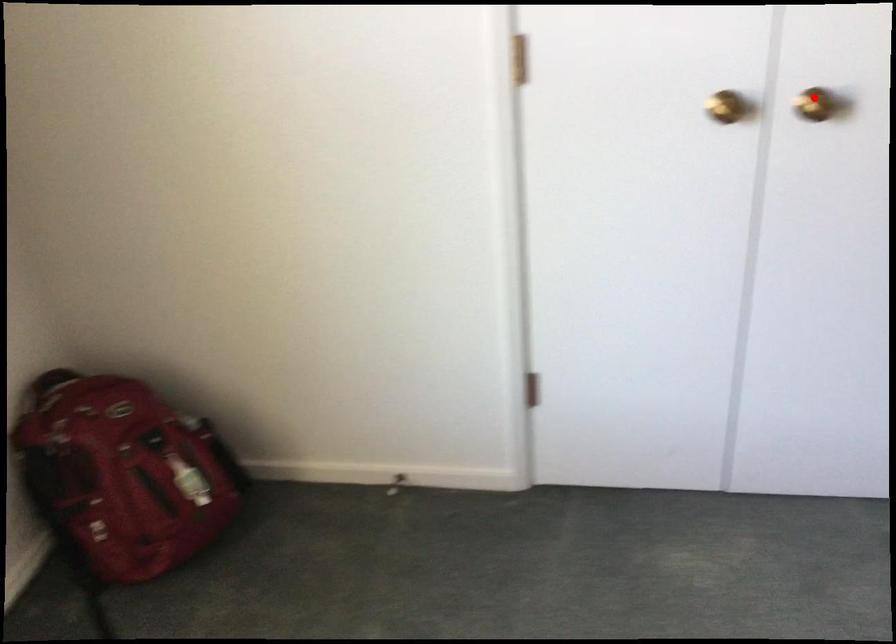
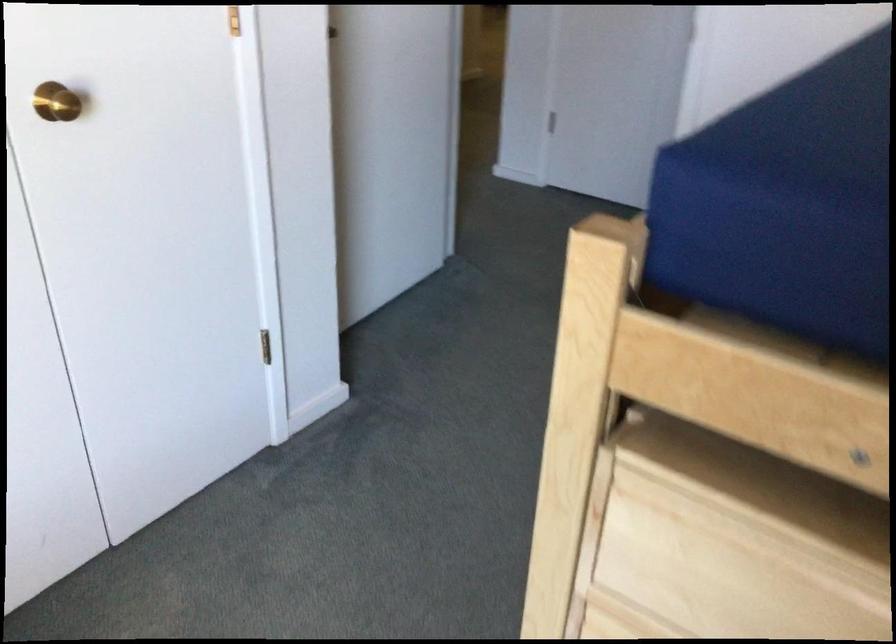
Question: A red point is marked in image1. In image2, is the corresponding 3D point closer to the camera or farther? Reply with the corresponding letter.

Choices:
 (A) The corresponding 3D point is closer.
 (B) The corresponding 3D point is farther.

Answer: (A)